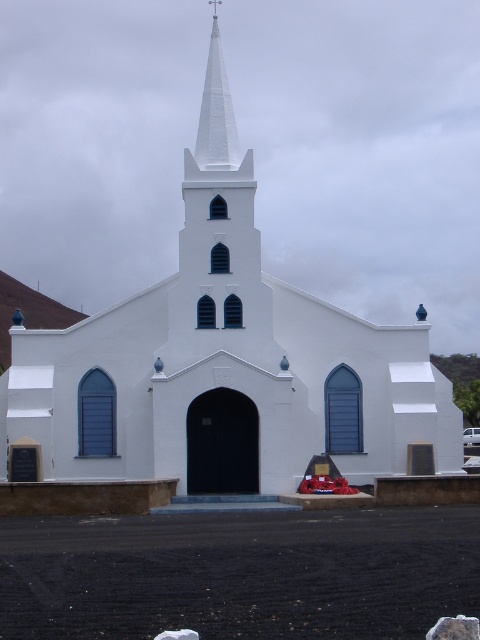
Can you confirm if white smooth steeple at upper center is shorter than white matte van at center?

No.

The height and width of the screenshot is (640, 480). Describe the element at coordinates (216, 115) in the screenshot. I see `white smooth steeple at upper center` at that location.

Which is in front, point (207, 93) or point (479, 428)?

Point (207, 93) is more forward.

Find the location of a particular element. This screenshot has width=480, height=640. white smooth steeple at upper center is located at coordinates (216, 115).

Between point (453, 618) and point (479, 433), which one is positioned in front?

Positioned in front is point (453, 618).

Is smooth gray rock at lower right thinner than white matte van at center?

Yes.

This screenshot has width=480, height=640. What do you see at coordinates (455, 628) in the screenshot?
I see `smooth gray rock at lower right` at bounding box center [455, 628].

The height and width of the screenshot is (640, 480). Find the location of `smooth gray rock at lower right`. smooth gray rock at lower right is located at coordinates (455, 628).

Does point (204, 163) come behind point (471, 620)?

Yes, it is behind point (471, 620).

Where is `white smooth steeple at upper center`? This screenshot has width=480, height=640. white smooth steeple at upper center is located at coordinates (216, 115).

This screenshot has width=480, height=640. I want to click on white smooth steeple at upper center, so click(216, 115).